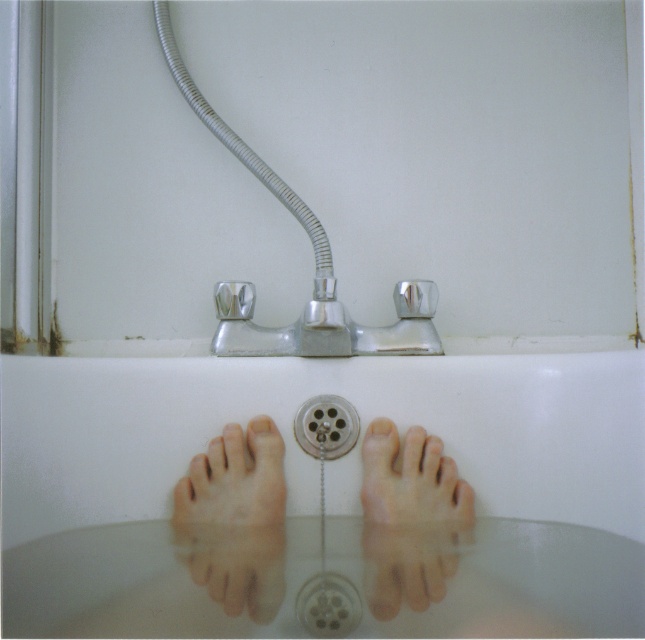
Does point (235, 512) lie behind point (439, 448)?

No, (235, 512) is in front of (439, 448).

Does point (366, 554) come farther from viewer compared to point (428, 468)?

That is False.

I want to click on skinny flesh-toned feet at center, so click(235, 522).

The height and width of the screenshot is (640, 645). Describe the element at coordinates (315, 266) in the screenshot. I see `chrome metallic shower head at upper center` at that location.

Does chrome metallic shower head at upper center have a smaller size compared to silver metallic drain at center?

Incorrect, chrome metallic shower head at upper center is not smaller in size than silver metallic drain at center.

At what (x,y) coordinates should I click in order to perform the action: click on chrome metallic shower head at upper center. Please return your answer as a coordinate pair (x, y). Looking at the image, I should click on (315, 266).

Locate an element on the screen. Image resolution: width=645 pixels, height=640 pixels. chrome metallic shower head at upper center is located at coordinates (315, 266).

Between chrome metallic shower head at upper center and pale skin foot at lower center, which one is positioned lower?

pale skin foot at lower center

Does chrome metallic shower head at upper center appear under pale skin foot at lower center?

No, chrome metallic shower head at upper center is not below pale skin foot at lower center.

The height and width of the screenshot is (640, 645). Identify the location of chrome metallic shower head at upper center. (315, 266).

Find the location of a particular element. This screenshot has height=640, width=645. chrome metallic shower head at upper center is located at coordinates (315, 266).